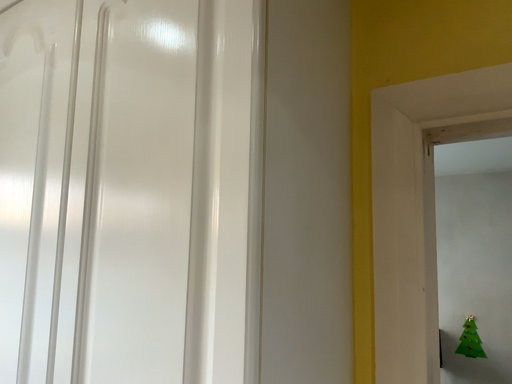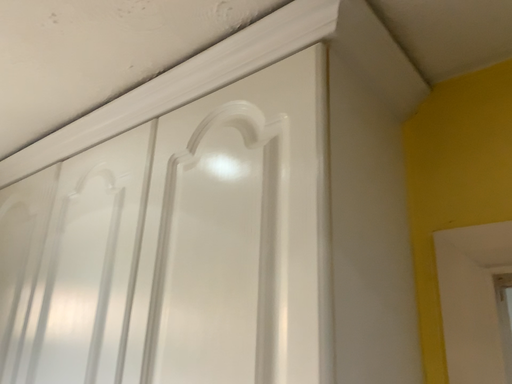
Question: Which way did the camera rotate in the video?

Choices:
 (A) rotated downward
 (B) rotated upward

Answer: (B)